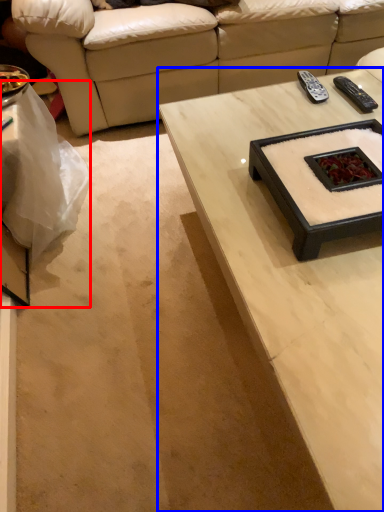
Question: Which object is closer to the camera taking this photo, table (highlighted by a red box) or coffee table (highlighted by a blue box)?

Choices:
 (A) table
 (B) coffee table

Answer: (B)